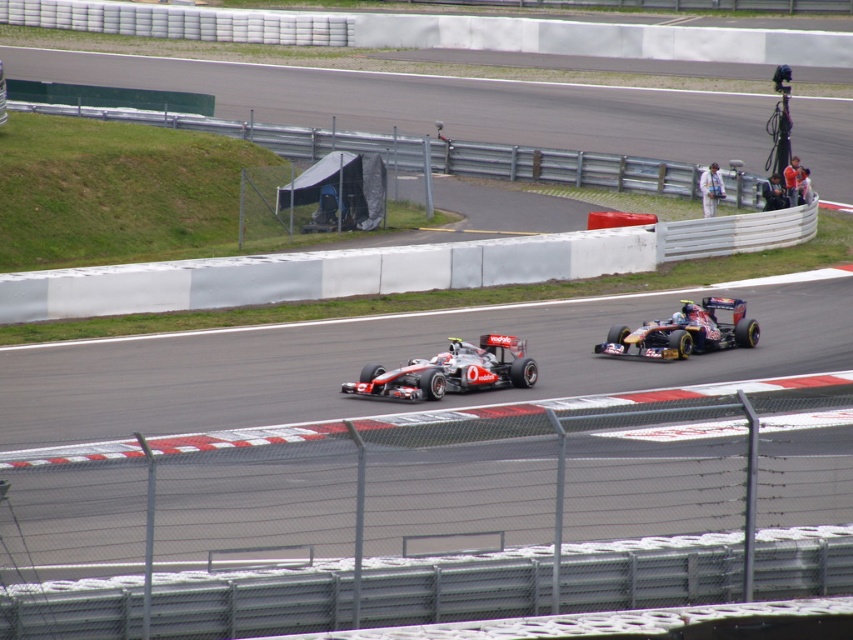
How distant is silver metallic race car at center from shiny metallic race car at center?

silver metallic race car at center is 3.10 meters from shiny metallic race car at center.

Between silver metallic race car at center and shiny metallic race car at center, which one appears on the right side from the viewer's perspective?

shiny metallic race car at center

Is point (376, 390) less distant than point (737, 337)?

Yes, it is in front of point (737, 337).

Locate an element on the screen. This screenshot has width=853, height=640. silver metallic race car at center is located at coordinates (451, 371).